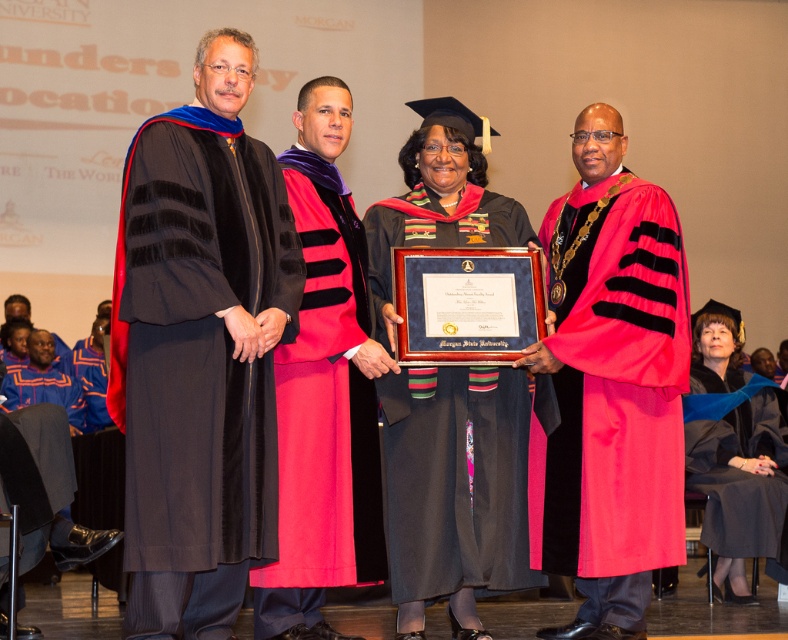
Question: Which point is closer to the camera taking this photo?

Choices:
 (A) (720, 461)
 (B) (456, 588)

Answer: (B)

Question: Which of the following is the closest to the observer?

Choices:
 (A) black velvet gown at center
 (B) red velvet gown at right
 (C) matte black graduation gown at center

Answer: (A)

Question: Can you confirm if black velvet gown at center is positioned to the right of matte black graduation gown at center?

Choices:
 (A) yes
 (B) no

Answer: (B)

Question: Where is red velvet gown at right located in relation to velvet red gown at center in the image?

Choices:
 (A) left
 (B) right

Answer: (B)

Question: Does red velvet gown at right appear over black matte graduation gown at center?

Choices:
 (A) no
 (B) yes

Answer: (A)

Question: Among these objects, which one is nearest to the camera?

Choices:
 (A) black velvet gown at center
 (B) black matte graduation gown at center
 (C) matte black graduation gown at center

Answer: (A)